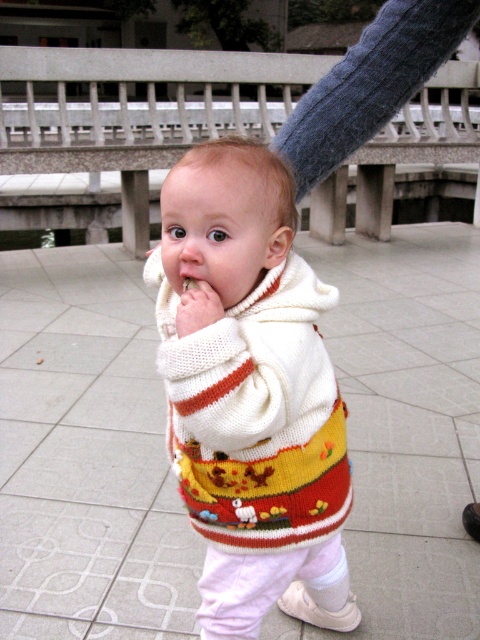
You are a photographer standing at a distance from the white knitted sweater at center. You want to take a closeup photo of it without moving closer. Do you think your camera with a 100mm lens can achieve this? Assume the camera sensor size requires a minimum of 100mm focal length to capture the sweater at this distance.

The distance between the white knitted sweater at center and the viewer is 36.93 inches. A 100mm lens can effectively capture closeup shots from this distance, so yes, the camera can take a closeup photo of the white knitted sweater at center without moving closer.

The child is holding something in their hand. Based on the scene, can you tell if the white knitted hand at center is above or below the white tile pavement at center?

The white knitted hand at center is above the white tile pavement at center because the pavement is positioned under the hand.

You are a drone operator trying to land a drone on the white tile pavement at center. The drone has a GPS coordinate system where the bottom left corner of the image is the origin point. The coordinates of the white tile pavement at center are given as point (x=86, y=456). If the drone is currently at point 0.5, 0.5, which direction should you move the drone to reach the white tile pavement at center?

The white tile pavement at center is located at point (x=86, y=456). Since the drone is at 0.5, 0.5, you need to move it northeast to reach the white tile pavement at center because the x coordinate increases to the right and the y coordinate decreases upward in this system.